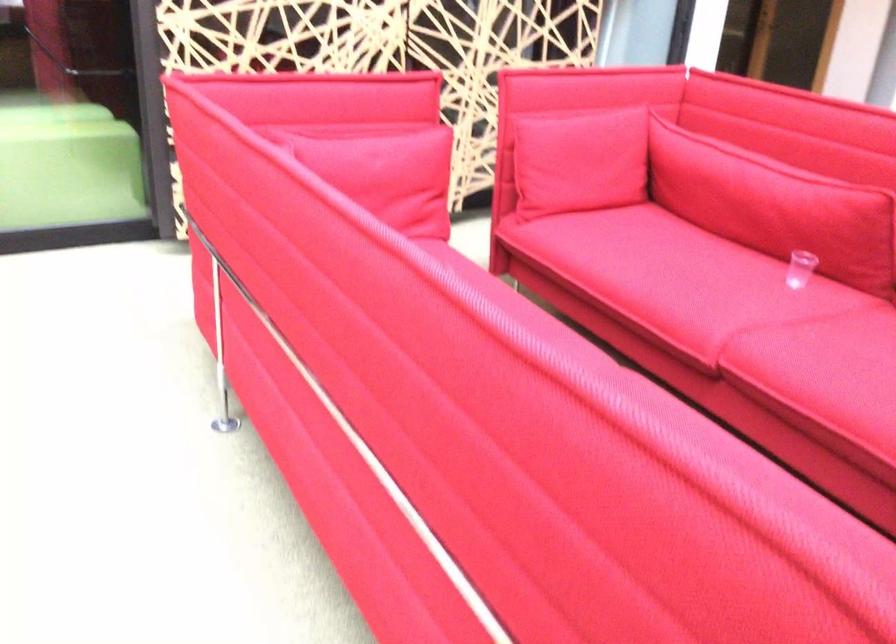
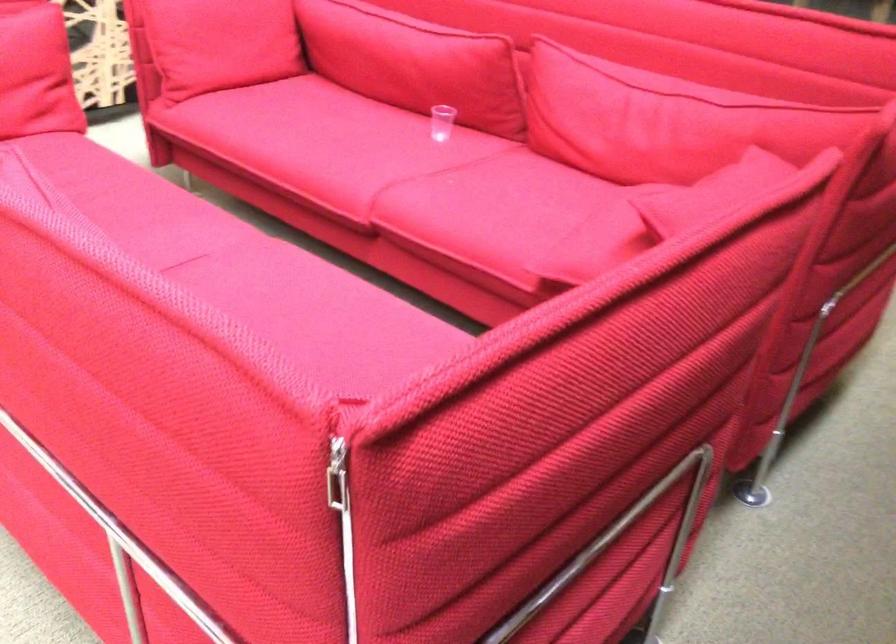
In the second image, find the point that corresponds to the point at 768,200 in the first image.

(414, 62)